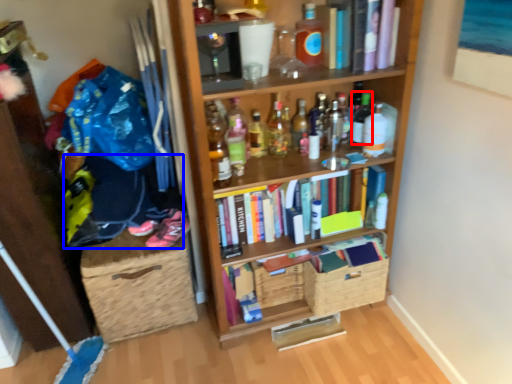
Question: Among these objects, which one is nearest to the camera, bottle (highlighted by a red box) or clothing (highlighted by a blue box)?

Choices:
 (A) bottle
 (B) clothing

Answer: (B)